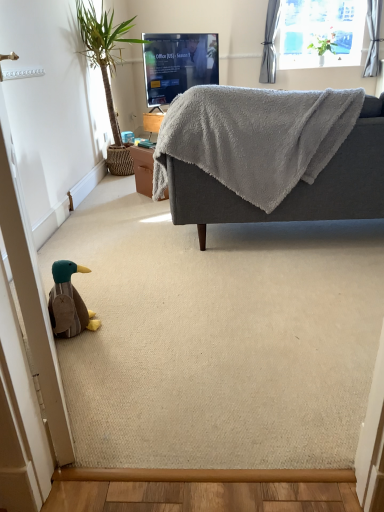
Question: Can you confirm if transparent glass window at upper center is positioned to the left of brown plush duck at lower left?

Choices:
 (A) yes
 (B) no

Answer: (B)

Question: Is the depth of transparent glass window at upper center greater than that of brown plush duck at lower left?

Choices:
 (A) yes
 (B) no

Answer: (A)

Question: Could you tell me if transparent glass window at upper center is turned towards brown plush duck at lower left?

Choices:
 (A) no
 (B) yes

Answer: (B)

Question: Is transparent glass window at upper center closer to the viewer compared to brown plush duck at lower left?

Choices:
 (A) no
 (B) yes

Answer: (A)

Question: From a real-world perspective, is transparent glass window at upper center under brown plush duck at lower left?

Choices:
 (A) no
 (B) yes

Answer: (A)

Question: Is point (278, 11) positioned closer to the camera than point (87, 311)?

Choices:
 (A) closer
 (B) farther

Answer: (B)

Question: Considering their positions, is gray fabric curtain at upper right located in front of or behind brown plush duck at lower left?

Choices:
 (A) behind
 (B) front

Answer: (A)

Question: Looking at their shapes, would you say gray fabric curtain at upper right is wider or thinner than brown plush duck at lower left?

Choices:
 (A) thin
 (B) wide

Answer: (B)

Question: Would you say gray fabric curtain at upper right is inside or outside brown plush duck at lower left?

Choices:
 (A) outside
 (B) inside

Answer: (A)

Question: Is transparent glass window at upper center wider or thinner than green leafy plant at left?

Choices:
 (A) wide
 (B) thin

Answer: (B)

Question: From a real-world perspective, is transparent glass window at upper center above or below green leafy plant at left?

Choices:
 (A) above
 (B) below

Answer: (A)

Question: From the image's perspective, is transparent glass window at upper center positioned above or below green leafy plant at left?

Choices:
 (A) below
 (B) above

Answer: (B)

Question: Based on their sizes in the image, would you say transparent glass window at upper center is bigger or smaller than green leafy plant at left?

Choices:
 (A) big
 (B) small

Answer: (B)

Question: In terms of width, does gray fabric curtain at upper right look wider or thinner when compared to matte black tv at upper center?

Choices:
 (A) thin
 (B) wide

Answer: (A)

Question: Is gray fabric curtain at upper right to the left or to the right of matte black tv at upper center in the image?

Choices:
 (A) right
 (B) left

Answer: (A)